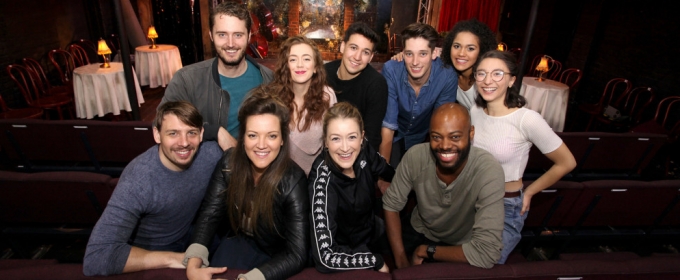
This screenshot has width=680, height=280. Identify the location of rightmost lamp. (543, 67).